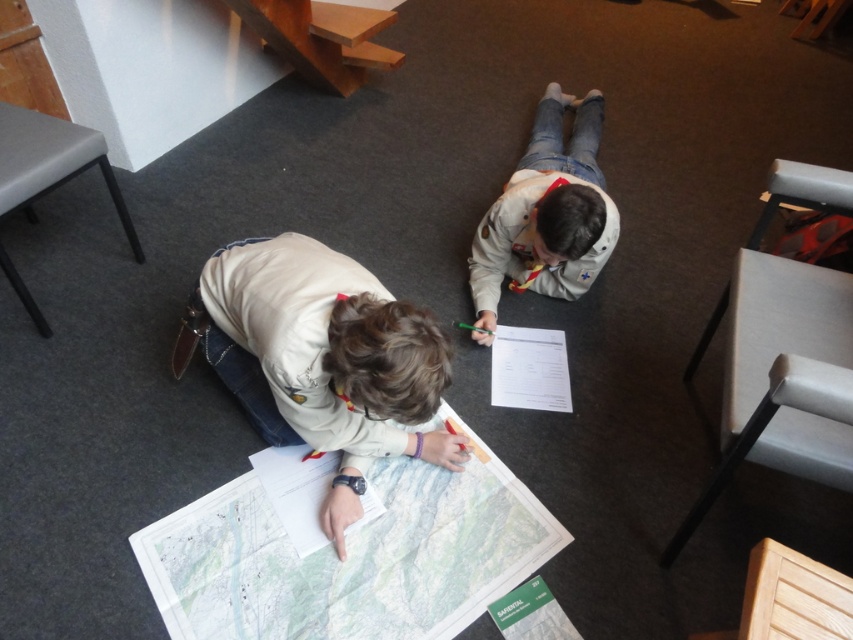
You are a delivery robot with a 30 inch wide package. You need to navigate through the space between the white paper map at center and the white uniform at center. Can you pass through this space without moving either object?

The distance between the white paper map at center and the white uniform at center is 29.51 inches. Since your package is 30 inches wide, it is slightly wider than the available space, so you cannot pass through without moving either object.

What are the coordinates of the white paper map at center in the image?

The white paper map at center is located at coordinates point (350, 557).